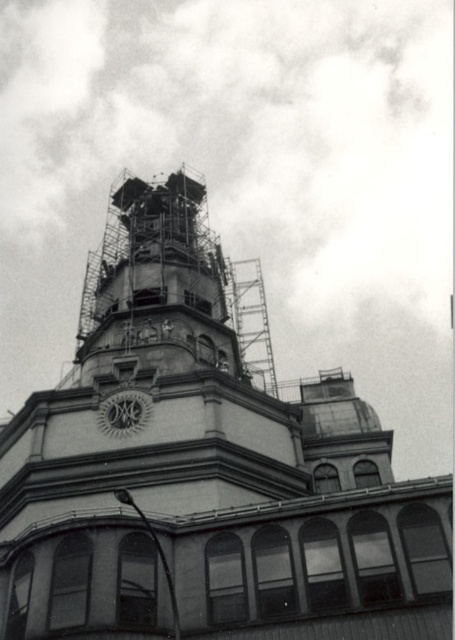
Who is higher up, stone scaffolding at center or white textured clock at center?

stone scaffolding at center is higher up.

Does stone scaffolding at center come in front of white textured clock at center?

That is True.

Who is more forward, [168,515] or [105,426]?

Positioned in front is point [168,515].

This screenshot has width=455, height=640. Identify the location of stone scaffolding at center. (207, 467).